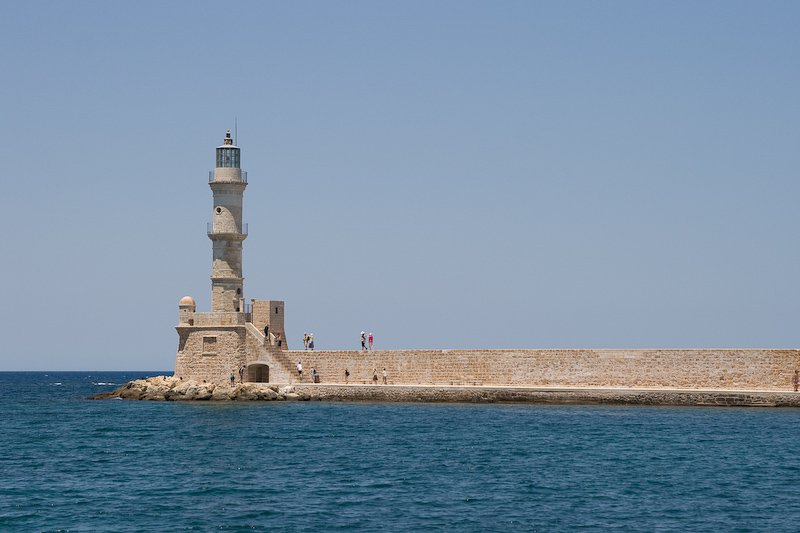
Where is `wall`? This screenshot has height=533, width=800. wall is located at coordinates (421, 369), (694, 369).